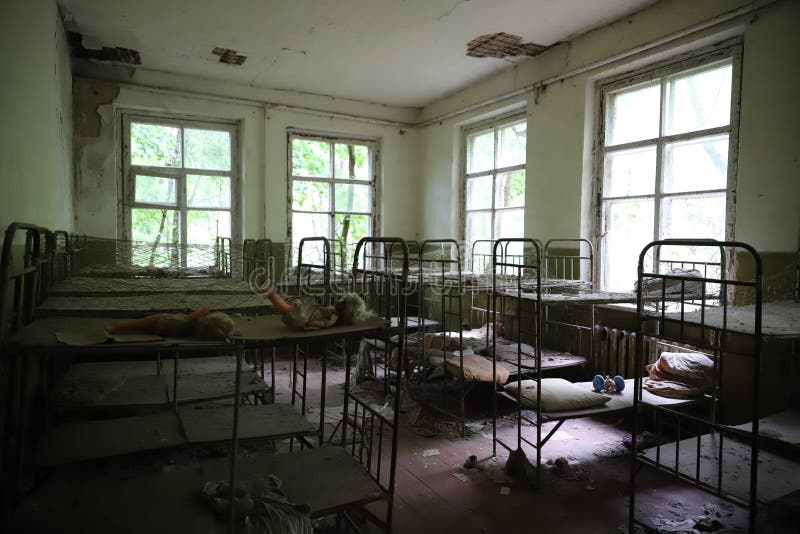
Find the location of a particular element. The image size is (800, 534). toy is located at coordinates 604,380.